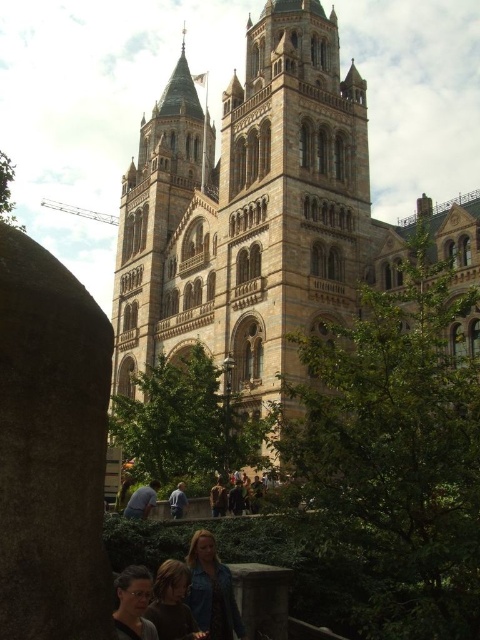
Question: Which point is closer to the camera taking this photo?

Choices:
 (A) (178, 516)
 (B) (224, 579)
 (C) (219, 509)

Answer: (B)

Question: Does brown stone church at center come in front of matte black glasses at lower center?

Choices:
 (A) no
 (B) yes

Answer: (A)

Question: Which object appears closest to the camera in this image?

Choices:
 (A) brown stone church at center
 (B) matte black glasses at lower center
 (C) dark brown leather jacket at lower center

Answer: (B)

Question: Does brown stone church at center have a larger size compared to light blue shirt at center?

Choices:
 (A) yes
 (B) no

Answer: (A)

Question: Considering the real-world distances, which object is farthest from the light blue shirt at lower center?

Choices:
 (A) dark brown leather jacket at lower center
 (B) brown stone church at center

Answer: (B)

Question: Does dark brown leather jacket at lower center appear over brown leather jacket at center?

Choices:
 (A) no
 (B) yes

Answer: (B)